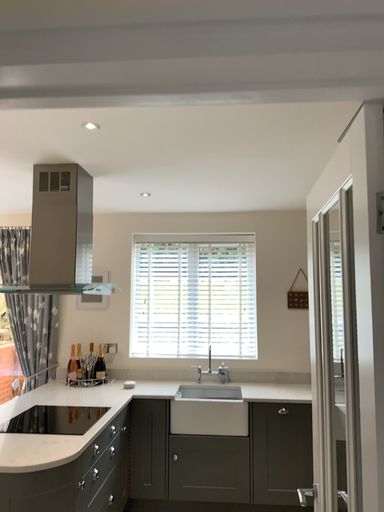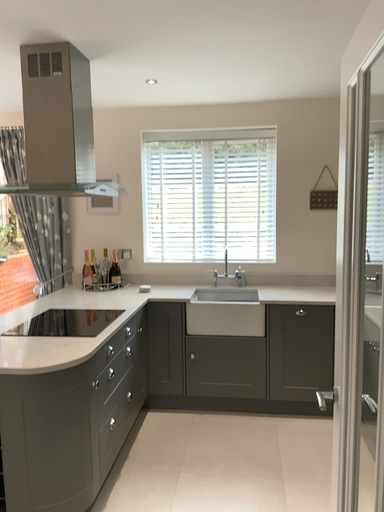
Question: Which way did the camera rotate in the video?

Choices:
 (A) rotated downward
 (B) rotated upward

Answer: (A)